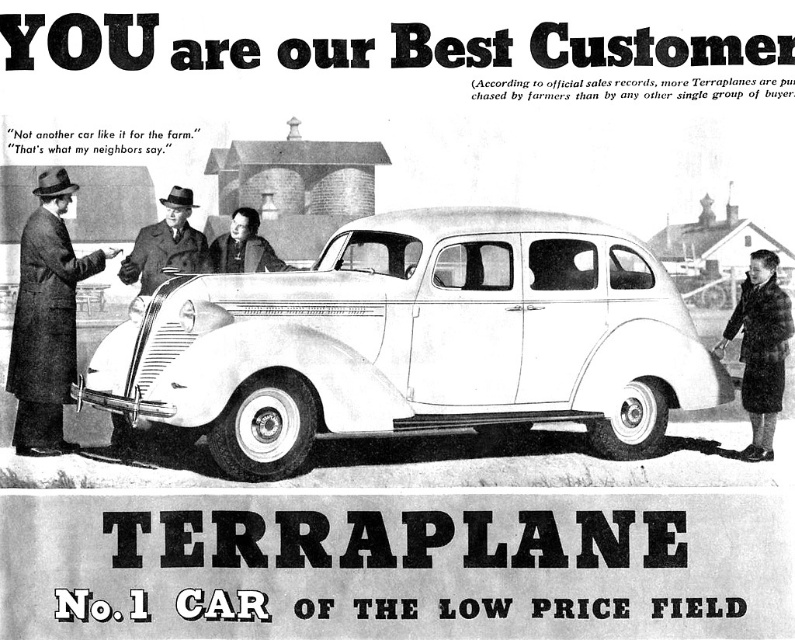
Question: Which object is closer to the camera taking this photo?

Choices:
 (A) dark brown fur coat at lower right
 (B) matte black coat at center
 (C) dark brown coat at left

Answer: (C)

Question: Can you confirm if dark brown coat at left is bigger than smooth leather coat at center?

Choices:
 (A) no
 (B) yes

Answer: (B)

Question: Is dark brown coat at left to the left of matte black coat at center from the viewer's perspective?

Choices:
 (A) no
 (B) yes

Answer: (B)

Question: Based on their relative distances, which object is farther from the white matte sedan at center?

Choices:
 (A) dark brown fur coat at lower right
 (B) matte black coat at center
 (C) dark brown coat at left

Answer: (C)

Question: Is white matte sedan at center further to camera compared to dark brown fur coat at lower right?

Choices:
 (A) yes
 (B) no

Answer: (B)

Question: Estimate the real-world distances between objects in this image. Which object is closer to the smooth leather coat at center?

Choices:
 (A) dark brown fur coat at lower right
 (B) matte black coat at center

Answer: (B)